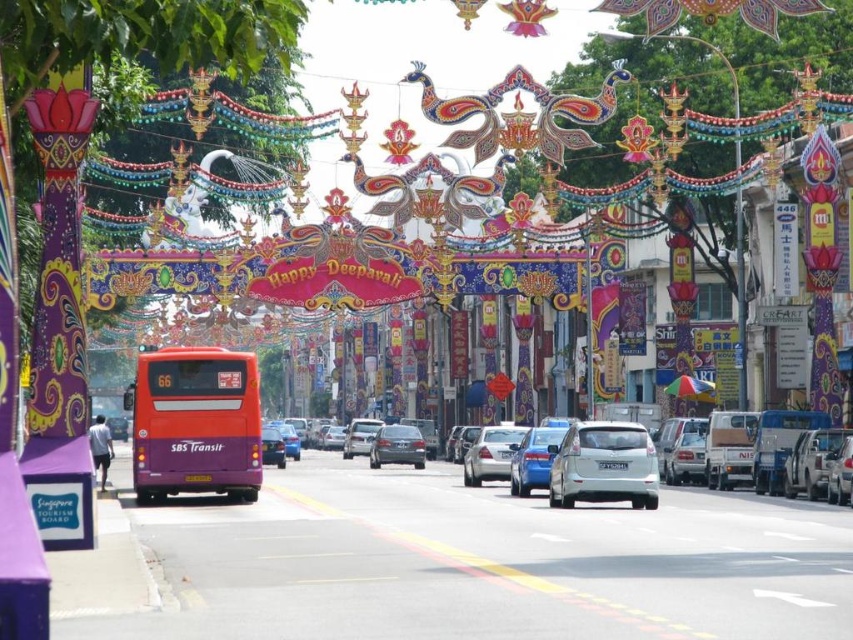
Identify the location of silver metallic hatchback at center. (604, 465).

Describe the element at coordinates (604, 465) in the screenshot. I see `silver metallic hatchback at center` at that location.

You are a GUI agent. You are given a task and a screenshot of the screen. Output one action in this format:
    pyautogui.click(x=<x>, y=<y>)
    Task: Click on the silver metallic hatchback at center
    This screenshot has width=853, height=640.
    Given the screenshot: What is the action you would take?
    pyautogui.click(x=604, y=465)

This screenshot has height=640, width=853. In order to click on silver metallic hatchback at center in this screenshot , I will do `click(604, 465)`.

Can you confirm if white glossy sedan at center is smaller than orange matte bus at center?

No.

Is white glossy sedan at center wider than orange matte bus at center?

Indeed, white glossy sedan at center has a greater width compared to orange matte bus at center.

Is point (422, 502) behind point (190, 388)?

Yes, it is behind point (190, 388).

Image resolution: width=853 pixels, height=640 pixels. Identify the location of white glossy sedan at center. (416, 492).

Is white glossy sedan at center positioned in front of satin silver sedan at center?

That is True.

Where is `white glossy sedan at center`? The image size is (853, 640). white glossy sedan at center is located at coordinates (416, 492).